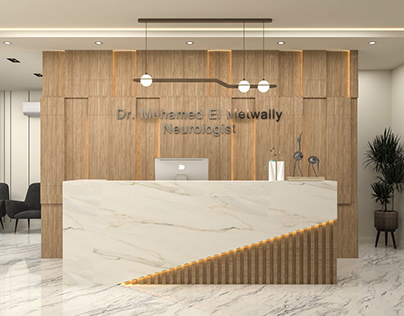
You are a GUI agent. You are given a task and a screenshot of the screen. Output one action in this format:
    pyautogui.click(x=<x>, y=<y>)
    Task: Click on the floor
    
    Given the screenshot: What is the action you would take?
    pyautogui.click(x=362, y=259)